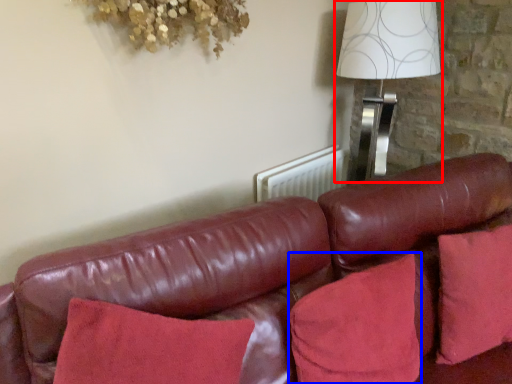
Question: Among these objects, which one is farthest to the camera, table lamp (highlighted by a red box) or pillow (highlighted by a blue box)?

Choices:
 (A) table lamp
 (B) pillow

Answer: (A)